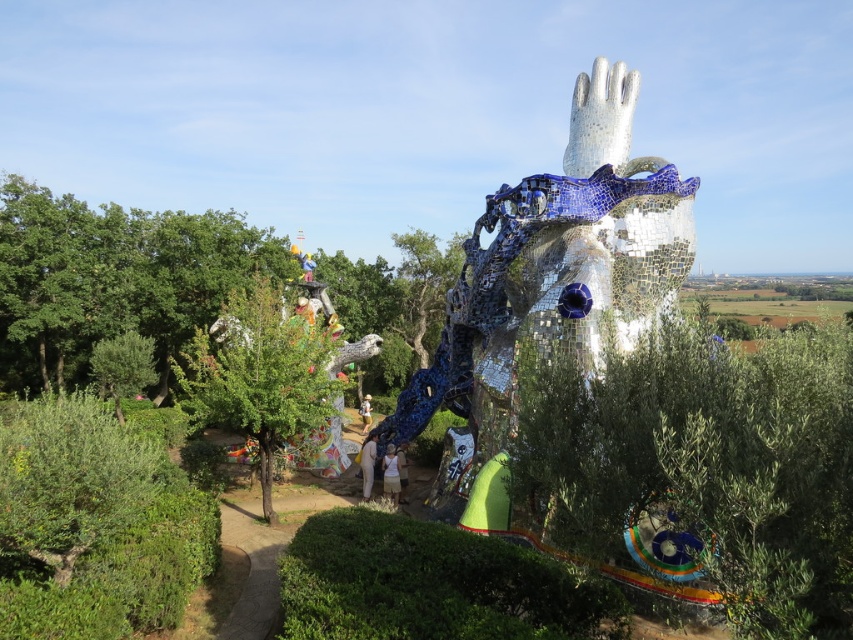
Question: Does green leafy hedge at lower left have a larger size compared to white fabric at center?

Choices:
 (A) yes
 (B) no

Answer: (A)

Question: Does green leafy olive tree at center have a larger size compared to white cotton shirt at center?

Choices:
 (A) yes
 (B) no

Answer: (A)

Question: Does green leafy hedge at lower center have a lesser width compared to white fabric at center?

Choices:
 (A) yes
 (B) no

Answer: (B)

Question: Which object is positioned closest to the green leafy olive tree at center?

Choices:
 (A) white cotton shirt at center
 (B) camouflage fabric shirt at center

Answer: (A)

Question: Which point appears closest to the camera in this image?

Choices:
 (A) (614, 99)
 (B) (265, 385)
 (C) (390, 474)

Answer: (B)

Question: Which of the following is the closest to the observer?

Choices:
 (A) (228, 376)
 (B) (57, 612)

Answer: (B)